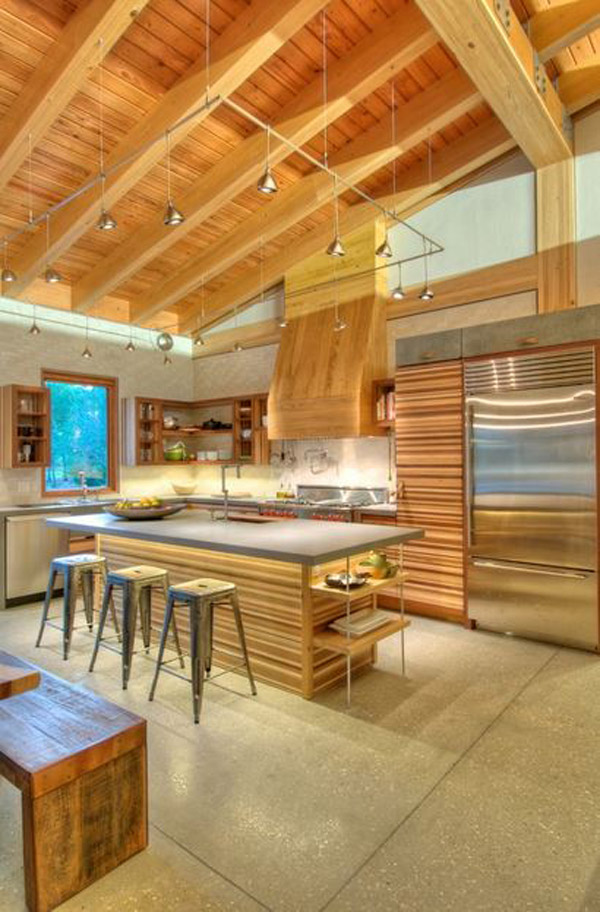
Identify the location of hanging lights. (348, 427), (266, 181), (173, 214), (101, 220).